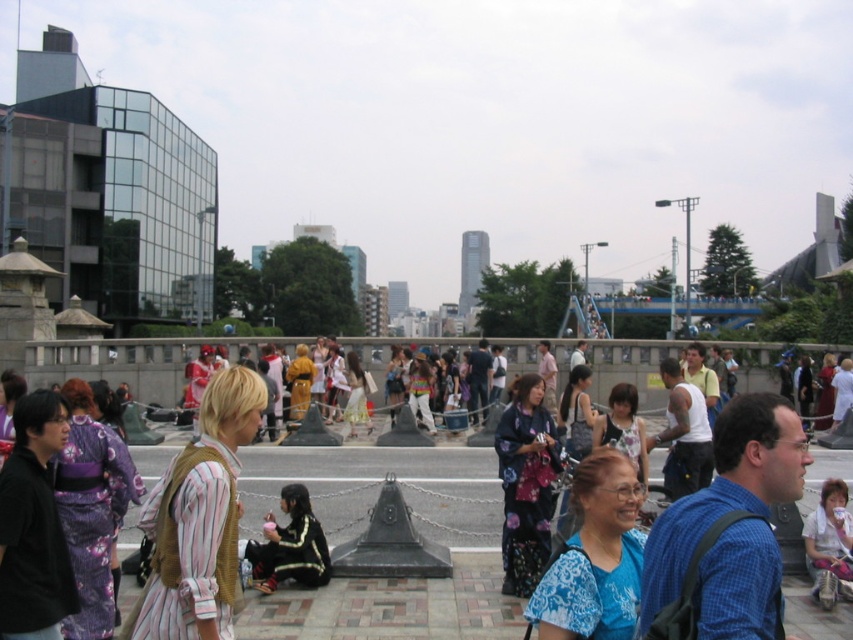
Question: From the image, what is the correct spatial relationship of floral kimono at center in relation to black leather jacket at center?

Choices:
 (A) above
 (B) below

Answer: (A)

Question: Based on their relative distances, which object is nearer to the purple silk kimono at left?

Choices:
 (A) white lace dress at center
 (B) blue floral blouse at center

Answer: (B)

Question: Is black leather jacket at center to the right of white cotton shirt at lower right from the viewer's perspective?

Choices:
 (A) yes
 (B) no

Answer: (B)

Question: Considering the relative positions of purple silk kimono at left and white lace dress at center in the image provided, where is purple silk kimono at left located with respect to white lace dress at center?

Choices:
 (A) right
 (B) left

Answer: (B)

Question: Which point is farther from the camera taking this photo?

Choices:
 (A) (825, 563)
 (B) (636, 552)

Answer: (A)

Question: Which of the following is the closest to the observer?

Choices:
 (A) black matte kimono at left
 (B) purple silk kimono at left

Answer: (A)